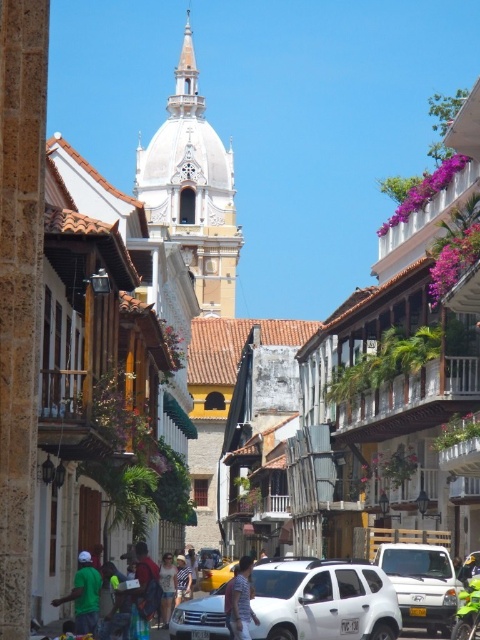
You are a delivery person trying to park your white matte suv at center in a spot that can only accommodate vehicles narrower than the denim shorts at center. Can your suv fit in that parking spot?

The white matte suv at center is wider than the denim shorts at center, so it cannot fit in the parking spot designed for vehicles narrower than the denim shorts at center.

You are a tourist standing at the center of the street and want to take a photo of the white matte suv at center and the green matte shirt at lower left. Which object should you focus on first if you want to capture both in a single frame without moving the camera?

You should focus on the white matte suv at center first because it is larger in size compared to the green matte shirt at lower left, allowing it to be more prominently featured in the frame while still including the smaller object.